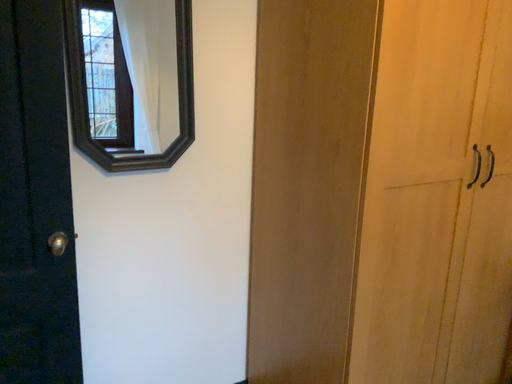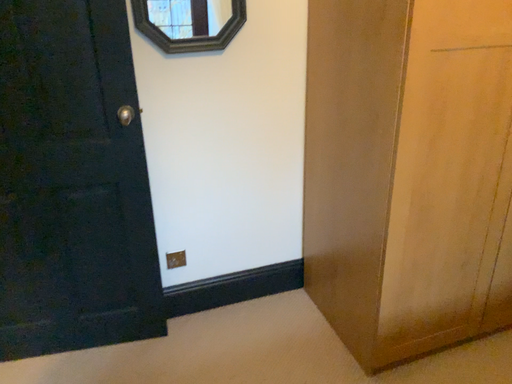
Question: How did the camera likely rotate when shooting the video?

Choices:
 (A) rotated left
 (B) rotated right

Answer: (A)